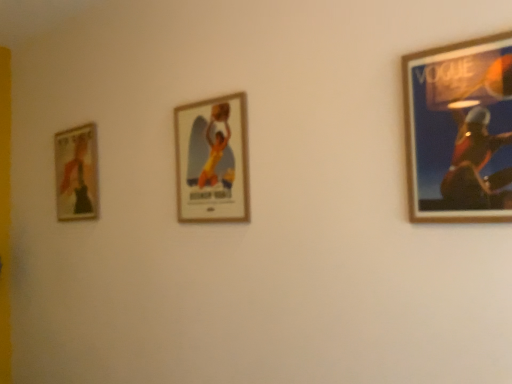
Question: From the image's perspective, is wooden framed poster at center, the 2th picture frame in the left-to-right sequence, below matte gold picture frame at left, marked as the 1th picture frame in a back-to-front arrangement?

Choices:
 (A) yes
 (B) no

Answer: (B)

Question: From the image's perspective, is wooden framed poster at center, which ranks as the 2th picture frame in right-to-left order, over matte gold picture frame at left, placed as the 3th picture frame when sorted from right to left?

Choices:
 (A) yes
 (B) no

Answer: (A)

Question: Considering the relative positions of wooden framed poster at center, the 2th picture frame in the left-to-right sequence, and matte gold picture frame at left, placed as the 3th picture frame when sorted from right to left, in the image provided, is wooden framed poster at center, the 2th picture frame in the left-to-right sequence, in front of matte gold picture frame at left, placed as the 3th picture frame when sorted from right to left,?

Choices:
 (A) no
 (B) yes

Answer: (B)

Question: Is wooden framed poster at center, the second picture frame positioned from the back, oriented towards matte gold picture frame at left, marked as the 1th picture frame in a back-to-front arrangement?

Choices:
 (A) no
 (B) yes

Answer: (A)

Question: Can you confirm if wooden framed poster at center, the 2th picture frame in the left-to-right sequence, is wider than matte gold picture frame at left, placed as the 3th picture frame when sorted from right to left?

Choices:
 (A) yes
 (B) no

Answer: (B)

Question: Considering the positions of matte gold picture frame at left, which ranks as the first picture frame in left-to-right order, and wooden framed poster at center, the 2th picture frame in the left-to-right sequence, in the image, is matte gold picture frame at left, which ranks as the first picture frame in left-to-right order, taller or shorter than wooden framed poster at center, the 2th picture frame in the left-to-right sequence,?

Choices:
 (A) tall
 (B) short

Answer: (A)

Question: Would you say matte gold picture frame at left, marked as the 1th picture frame in a back-to-front arrangement, is inside or outside wooden framed poster at center, the 2th picture frame in the left-to-right sequence?

Choices:
 (A) outside
 (B) inside

Answer: (A)

Question: Considering the positions of point [x=75, y=157] and point [x=224, y=96], is point [x=75, y=157] closer or farther from the camera than point [x=224, y=96]?

Choices:
 (A) closer
 (B) farther

Answer: (B)

Question: Looking at the image, does matte gold picture frame at left, the third picture frame from the front, seem bigger or smaller compared to wooden framed poster at center, the 2th picture frame in the left-to-right sequence?

Choices:
 (A) small
 (B) big

Answer: (B)

Question: Is matte gold picture frame at left, which ranks as the first picture frame in left-to-right order, taller or shorter than wooden frame at right, which is the 1th picture frame in right-to-left order?

Choices:
 (A) short
 (B) tall

Answer: (B)

Question: From the image's perspective, relative to wooden frame at right, the 1th picture frame when ordered from front to back, is matte gold picture frame at left, placed as the 3th picture frame when sorted from right to left, above or below?

Choices:
 (A) below
 (B) above

Answer: (A)

Question: Considering the positions of point (90, 140) and point (472, 157), is point (90, 140) closer or farther from the camera than point (472, 157)?

Choices:
 (A) farther
 (B) closer

Answer: (A)

Question: Is matte gold picture frame at left, the third picture frame from the front, situated inside wooden frame at right, which is the 1th picture frame in right-to-left order, or outside?

Choices:
 (A) inside
 (B) outside

Answer: (B)

Question: From a real-world perspective, is wooden frame at right, the 1th picture frame when ordered from front to back, positioned above or below wooden framed poster at center, the 2th picture frame in the left-to-right sequence?

Choices:
 (A) below
 (B) above

Answer: (A)

Question: Is wooden frame at right, which is the 1th picture frame in right-to-left order, wider or thinner than wooden framed poster at center, acting as the second picture frame starting from the front?

Choices:
 (A) thin
 (B) wide

Answer: (A)